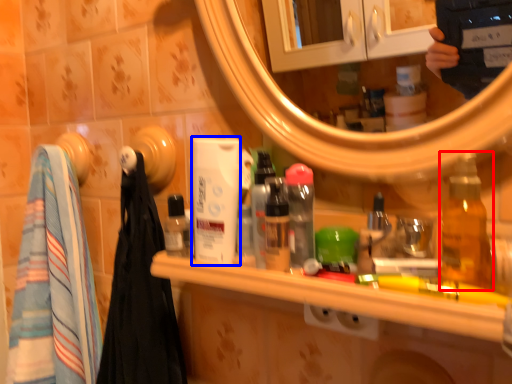
Question: Which point is closer to the camera, bottle (highlighted by a red box) or mouthwash (highlighted by a blue box)?

Choices:
 (A) bottle
 (B) mouthwash

Answer: (A)